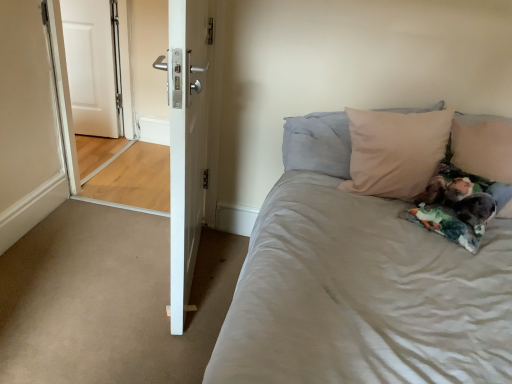
In order to face beige fabric pillow at upper right, the 1th pillow from the right, should I rotate leftwards or rightwards?

You should look right and rotate roughly 29.186 degrees.

Identify the location of beige fabric pillow at upper right, which is the 1th pillow in left-to-right order. (318, 143).

Locate an element on the screen. The width and height of the screenshot is (512, 384). white glossy door at left is located at coordinates (119, 99).

Measure the distance between point (85, 70) and camera.

A distance of 3.03 meters exists between point (85, 70) and camera.

You are a GUI agent. You are given a task and a screenshot of the screen. Output one action in this format:
    pyautogui.click(x=<x>, y=<y>)
    Task: Click on the beige fabric pillow at upper right, the 1th pillow from the right
    This screenshot has width=512, height=384.
    Given the screenshot: What is the action you would take?
    pyautogui.click(x=483, y=146)

Is point (184, 265) farther from viewer compared to point (83, 62)?

No, it is in front of (83, 62).

Based on the photo, is white glossy door at center, the 2th door from the left, not close to white glossy door at left?

Yes, white glossy door at center, the 2th door from the left, and white glossy door at left are located far from each other.

From a real-world perspective, is white glossy door at center, which is counted as the 2th door, starting from the back, physically located above or below white glossy door at left?

Clearly, from a real-world perspective, white glossy door at center, which is counted as the 2th door, starting from the back, is above white glossy door at left.

Could white glossy door at left be considered to be inside white glossy door at center, positioned as the 1th door in front-to-back order?

Definitely not — white glossy door at left is not inside white glossy door at center, positioned as the 1th door in front-to-back order.

Who is smaller, white matte door at left, the second door when ordered from front to back, or beige fabric pillow at upper right, the 1th pillow from the right?

Smaller between the two is white matte door at left, the second door when ordered from front to back.

Is white matte door at left, marked as the first door in a left-to-right arrangement, positioned before beige fabric pillow at upper right, the 1th pillow from the right?

No.

In terms of height, does white matte door at left, the second door when ordered from front to back, look taller or shorter compared to beige fabric pillow at upper right, the 1th pillow from the right?

white matte door at left, the second door when ordered from front to back, is taller than beige fabric pillow at upper right, the 1th pillow from the right.

Considering the points (103, 35) and (453, 151), which point is behind, point (103, 35) or point (453, 151)?

The point (103, 35) is farther from the camera.

Between point (99, 45) and point (177, 163), which one is positioned behind?

The point (99, 45) is farther.

In the image, is white matte door at left, marked as the first door in a left-to-right arrangement, positioned in front of or behind white glossy door at center, which is counted as the 2th door, starting from the back?

white matte door at left, marked as the first door in a left-to-right arrangement, is behind white glossy door at center, which is counted as the 2th door, starting from the back.

Is white glossy door at center, which is counted as the 2th door, starting from the back, surrounded by white matte door at left, marked as the first door in a left-to-right arrangement?

No, white glossy door at center, which is counted as the 2th door, starting from the back, is not a part of white matte door at left, marked as the first door in a left-to-right arrangement.

Is white matte door at left, which ranks as the 1th door in back-to-front order, taller or shorter than white glossy door at center, the first door when ordered from right to left?

white matte door at left, which ranks as the 1th door in back-to-front order, is shorter than white glossy door at center, the first door when ordered from right to left.

Is white glossy door at center, which is counted as the 2th door, starting from the back, at the back of beige fabric pillow at upper right, which is the 1th pillow in left-to-right order?

Yes, white glossy door at center, which is counted as the 2th door, starting from the back, is at the back of beige fabric pillow at upper right, which is the 1th pillow in left-to-right order.

Is beige fabric pillow at upper right, which is the 1th pillow in left-to-right order, located outside white glossy door at center, the first door when ordered from right to left?

Yes.

How far apart are beige fabric pillow at upper right, placed as the second pillow when sorted from right to left, and white glossy door at center, the first door when ordered from right to left?

The distance of beige fabric pillow at upper right, placed as the second pillow when sorted from right to left, from white glossy door at center, the first door when ordered from right to left, is 21.93 inches.

Is there a large distance between beige fabric pillow at upper right, placed as the second pillow when sorted from right to left, and white glossy door at center, positioned as the 1th door in front-to-back order?

No, beige fabric pillow at upper right, placed as the second pillow when sorted from right to left, is not far from white glossy door at center, positioned as the 1th door in front-to-back order.

Considering the positions of objects beige fabric pillow at upper right, the second pillow when ordered from left to right, and beige fabric pillow at upper right, which is the 1th pillow in left-to-right order, in the image provided, who is more to the left, beige fabric pillow at upper right, the second pillow when ordered from left to right, or beige fabric pillow at upper right, which is the 1th pillow in left-to-right order,?

Positioned to the left is beige fabric pillow at upper right, which is the 1th pillow in left-to-right order.

Does beige fabric pillow at upper right, the second pillow when ordered from left to right, turn towards beige fabric pillow at upper right, which is the 1th pillow in left-to-right order?

No, beige fabric pillow at upper right, the second pillow when ordered from left to right, does not turn towards beige fabric pillow at upper right, which is the 1th pillow in left-to-right order.

Which is in front, point (477, 144) or point (288, 147)?

The point (477, 144) is closer.

In the scene shown: Which object is more forward, white glossy door at center, the first door when ordered from right to left, or beige fabric pillow at upper right, placed as the second pillow when sorted from right to left?

white glossy door at center, the first door when ordered from right to left.

Is white glossy door at center, the 2th door from the left, directly adjacent to beige fabric pillow at upper right, placed as the second pillow when sorted from right to left?

white glossy door at center, the 2th door from the left, and beige fabric pillow at upper right, placed as the second pillow when sorted from right to left, are clearly separated.

Does white glossy door at center, positioned as the 1th door in front-to-back order, turn towards beige fabric pillow at upper right, placed as the second pillow when sorted from right to left?

Yes.

Can you confirm if white glossy door at center, the 2th door from the left, is taller than beige fabric pillow at upper right, the 1th pillow from the right?

Yes.

Is white glossy door at center, the 2th door from the left, closer to the viewer compared to beige fabric pillow at upper right, the second pillow when ordered from left to right?

Yes, white glossy door at center, the 2th door from the left, is in front of beige fabric pillow at upper right, the second pillow when ordered from left to right.

From the image's perspective, which one is positioned higher, white glossy door at center, the first door when ordered from right to left, or beige fabric pillow at upper right, the 1th pillow from the right?

beige fabric pillow at upper right, the 1th pillow from the right.

Is white glossy door at center, positioned as the 1th door in front-to-back order, surrounding beige fabric pillow at upper right, the 1th pillow from the right?

Definitely not — beige fabric pillow at upper right, the 1th pillow from the right, is not inside white glossy door at center, positioned as the 1th door in front-to-back order.

Where is `door on the right of white glossy door at left`? door on the right of white glossy door at left is located at coordinates point(186,144).

From the white matte door at left, the 2th door in the right-to-left sequence, count 2nd pillows forward and point to it. Please provide its 2D coordinates.

[(483, 146)]

In the scene shown: Considering their positions, is white glossy door at left positioned closer to beige fabric pillow at upper right, the second pillow when ordered from left to right, than white glossy door at center, the 2th door from the left?

white glossy door at center, the 2th door from the left, is closer to beige fabric pillow at upper right, the second pillow when ordered from left to right.

From the picture: Considering their positions, is beige fabric pillow at upper right, placed as the second pillow when sorted from right to left, positioned closer to white matte door at left, the second door when ordered from front to back, than beige fabric pillow at upper right, the second pillow when ordered from left to right?

beige fabric pillow at upper right, placed as the second pillow when sorted from right to left.

From the image, which object appears to be farther from white glossy door at center, the 2th door from the left, beige fabric pillow at upper right, the 1th pillow from the right, or beige fabric pillow at upper right, placed as the second pillow when sorted from right to left?

beige fabric pillow at upper right, the 1th pillow from the right.

When comparing their distances from beige fabric pillow at upper right, the second pillow when ordered from left to right, does white glossy door at center, which is counted as the 2th door, starting from the back, or beige fabric pillow at upper right, which is the 1th pillow in left-to-right order, seem closer?

Among the two, beige fabric pillow at upper right, which is the 1th pillow in left-to-right order, is located nearer to beige fabric pillow at upper right, the second pillow when ordered from left to right.

Which object lies further to the anchor point white glossy door at left, white matte door at left, the 2th door in the right-to-left sequence, or white glossy door at center, positioned as the 1th door in front-to-back order?

Among the two, white glossy door at center, positioned as the 1th door in front-to-back order, is located further to white glossy door at left.

Estimate the real-world distances between objects in this image. Which object is closer to white glossy door at center, the first door when ordered from right to left, white glossy door at left or beige fabric pillow at upper right, which is the 1th pillow in left-to-right order?

beige fabric pillow at upper right, which is the 1th pillow in left-to-right order, is closer to white glossy door at center, the first door when ordered from right to left.

From the image, which object appears to be nearer to beige fabric pillow at upper right, the 1th pillow from the right, white glossy door at center, positioned as the 1th door in front-to-back order, or white matte door at left, which ranks as the 1th door in back-to-front order?

The object closer to beige fabric pillow at upper right, the 1th pillow from the right, is white glossy door at center, positioned as the 1th door in front-to-back order.

Estimate the real-world distances between objects in this image. Which object is closer to white matte door at left, the 2th door in the right-to-left sequence, beige fabric pillow at upper right, the second pillow when ordered from left to right, or white glossy door at left?

white glossy door at left.

I want to click on pillow between white glossy door at center, the 2th door from the left, and beige fabric pillow at upper right, the 1th pillow from the right, in the horizontal direction, so click(318, 143).

You are a GUI agent. You are given a task and a screenshot of the screen. Output one action in this format:
    pyautogui.click(x=<x>, y=<y>)
    Task: Click on the pillow between white glossy door at left and beige fabric pillow at upper right, the 1th pillow from the right, in the horizontal direction
    Image resolution: width=512 pixels, height=384 pixels.
    Given the screenshot: What is the action you would take?
    pyautogui.click(x=318, y=143)

Find the location of a particular element. The width and height of the screenshot is (512, 384). door located between white glossy door at left and beige fabric pillow at upper right, placed as the second pillow when sorted from right to left, in the left-right direction is located at coordinates (186, 144).

The width and height of the screenshot is (512, 384). I want to click on pillow located between white matte door at left, the 2th door in the right-to-left sequence, and beige fabric pillow at upper right, the second pillow when ordered from left to right, in the left-right direction, so click(318, 143).